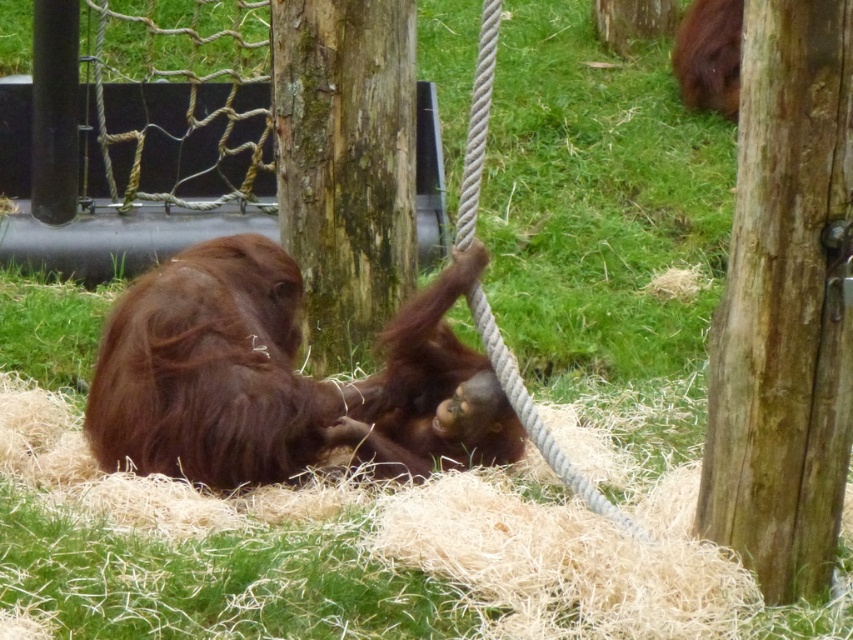
Who is lower down, smooth brown wood at right or brown furry orangutan at upper right?

smooth brown wood at right is below.

How much distance is there between smooth brown wood at right and brown furry orangutan at upper right?

smooth brown wood at right is 17.49 feet away from brown furry orangutan at upper right.

Does point (770, 458) come closer to viewer compared to point (715, 19)?

Yes, point (770, 458) is in front of point (715, 19).

This screenshot has width=853, height=640. In order to click on smooth brown wood at right in this screenshot , I will do `click(785, 305)`.

Does point (372, 445) come behind point (701, 38)?

No, it is not.

Between point (409, 300) and point (712, 74), which one is positioned behind?

Point (712, 74)

Where is `brown furry orangutan at center`? The width and height of the screenshot is (853, 640). brown furry orangutan at center is located at coordinates (434, 390).

Who is lower down, brown furry orangutan at lower left or brown furry orangutan at upper right?

brown furry orangutan at lower left

Measure the distance between point (144, 410) and camera.

4.89 meters

The height and width of the screenshot is (640, 853). Identify the location of brown furry orangutan at lower left. (212, 371).